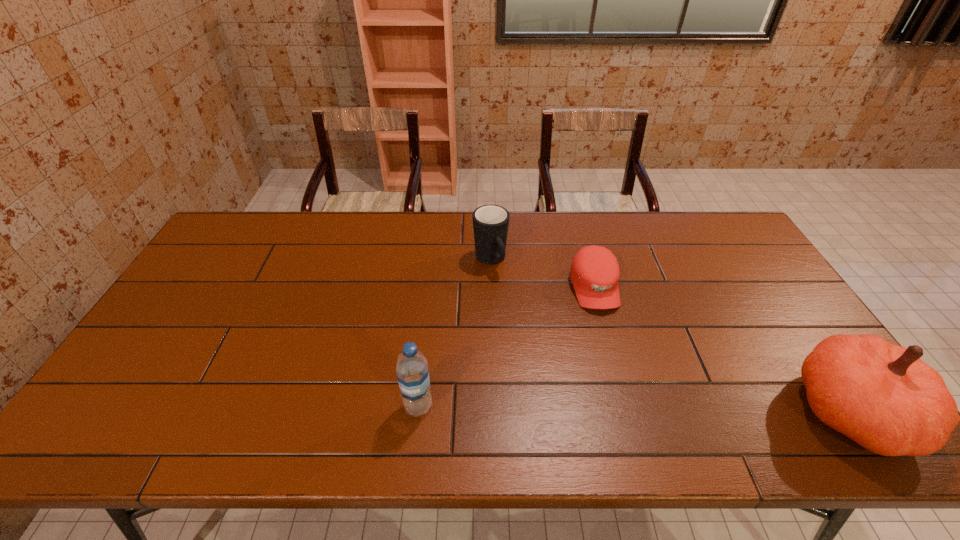
Locate an element on the screen. The image size is (960, 540). vacant space located 0.240m on the front-facing side of the third object from left to right is located at coordinates (625, 387).

Locate an element on the screen. free space located 0.180m on the front-facing side of the third object from left to right is located at coordinates (618, 367).

You are a GUI agent. You are given a task and a screenshot of the screen. Output one action in this format:
    pyautogui.click(x=<x>, y=<y>)
    Task: Click on the free point located 0.100m on the side of the second object from left to right with the handle
    This screenshot has width=960, height=540.
    Given the screenshot: What is the action you would take?
    pyautogui.click(x=509, y=298)

You are a GUI agent. You are given a task and a screenshot of the screen. Output one action in this format:
    pyautogui.click(x=<x>, y=<y>)
    Task: Click on the vacant area located on the side of the second object from left to right with the handle
    Image resolution: width=960 pixels, height=540 pixels.
    Given the screenshot: What is the action you would take?
    pyautogui.click(x=527, y=329)

The image size is (960, 540). Identify the location of vacant point located on the side of the second object from left to right with the handle. (511, 300).

You are a GUI agent. You are given a task and a screenshot of the screen. Output one action in this format:
    pyautogui.click(x=<x>, y=<y>)
    Task: Click on the object present at the far edge
    
    Given the screenshot: What is the action you would take?
    pyautogui.click(x=490, y=222)

Where is `water bottle that is at the near edge`? water bottle that is at the near edge is located at coordinates (412, 372).

Locate an element on the screen. pumpkin that is at the near edge is located at coordinates pos(883,396).

This screenshot has height=540, width=960. Find the location of `object that is at the right edge`. object that is at the right edge is located at coordinates (883, 396).

Locate an element on the screen. This screenshot has width=960, height=540. object at the near right corner is located at coordinates (883, 396).